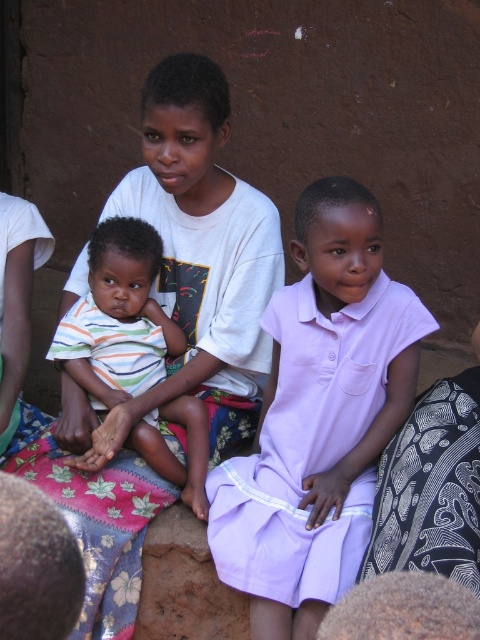
From the picture: Can you confirm if lavender cotton dress at center is positioned above striped cotton shirt at center?

No, lavender cotton dress at center is not above striped cotton shirt at center.

Can you confirm if lavender cotton dress at center is smaller than striped cotton shirt at center?

No.

What are the coordinates of `lavender cotton dress at center` in the screenshot? It's located at (319, 417).